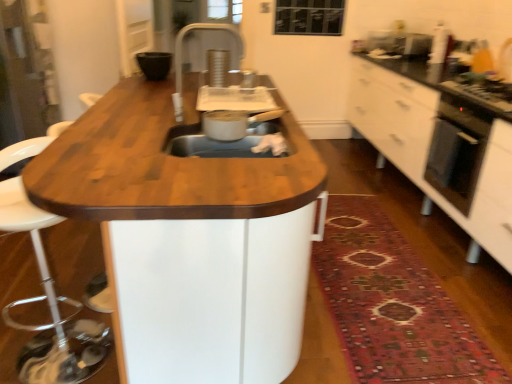
Question: From the image's perspective, is white glossy cabinet at right above or below black matte bowl at upper center?

Choices:
 (A) above
 (B) below

Answer: (B)

Question: Relative to black matte bowl at upper center, is white glossy cabinet at right in front or behind?

Choices:
 (A) front
 (B) behind

Answer: (A)

Question: Based on their relative distances, which object is farther from the black glass gas stove at right?

Choices:
 (A) black glass oven at right
 (B) metallic silver pot at center sink
 (C) black matte bowl at upper center
 (D) white glossy cabinet at right
 (E) wooden table at center

Answer: (C)

Question: Which of these objects is positioned farthest from the metallic silver pot at center sink?

Choices:
 (A) black glass oven at right
 (B) silver metallic faucet at upper center
 (C) black matte bowl at upper center
 (D) wooden table at center
 (E) wooden swivel chair at left

Answer: (C)